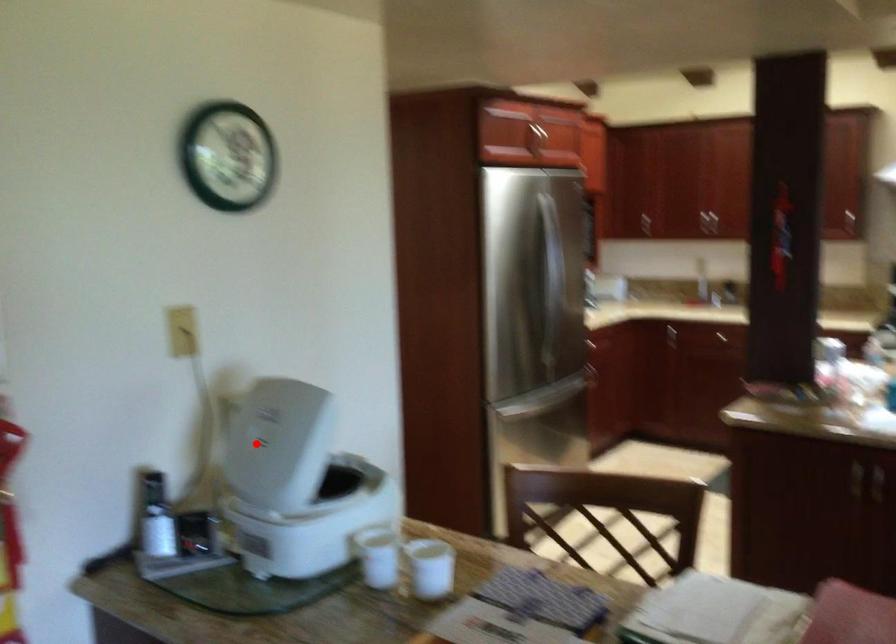
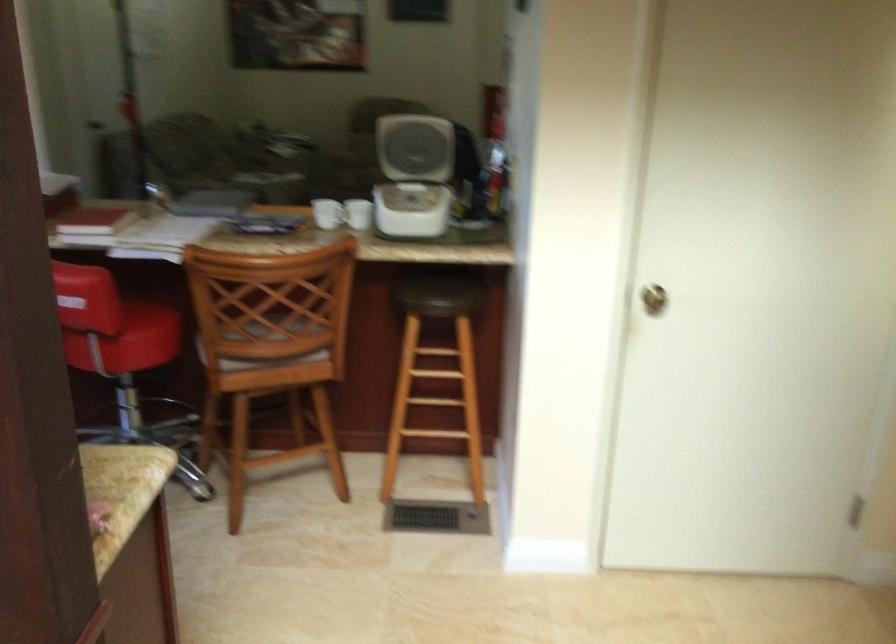
Locate, in the second image, the point that corresponds to the highlighted location in the first image.

(416, 137)